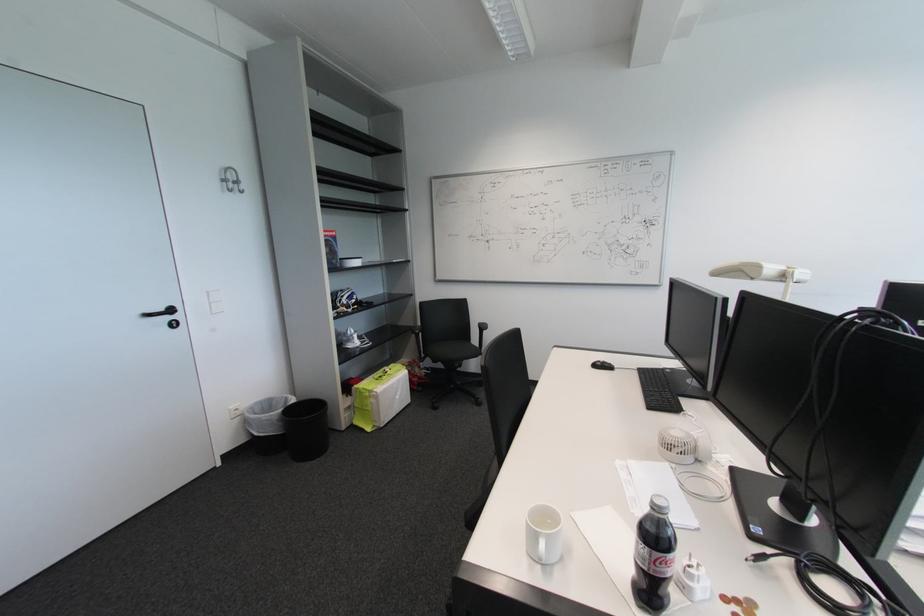
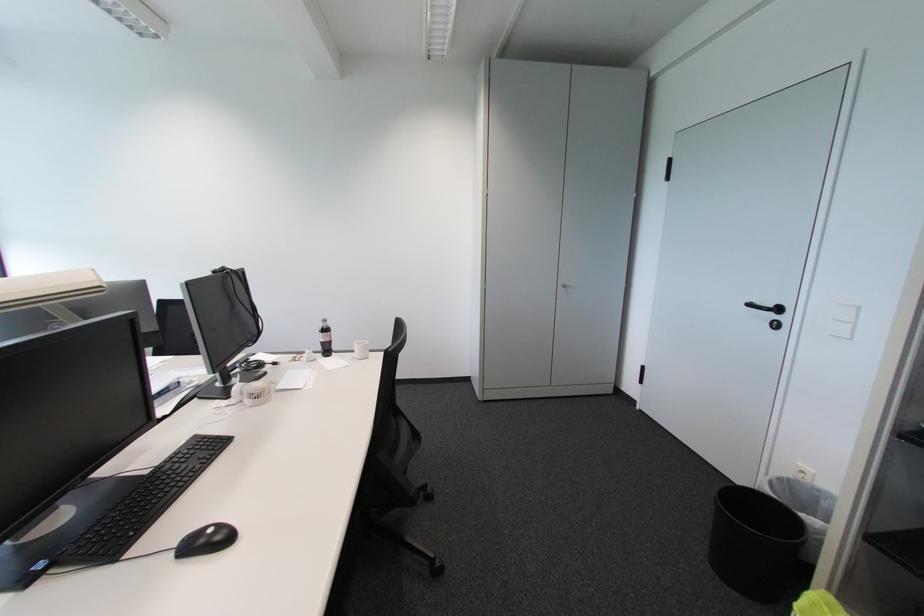
In the second image, find the point that corresponds to [242,413] in the first image.

(809, 477)